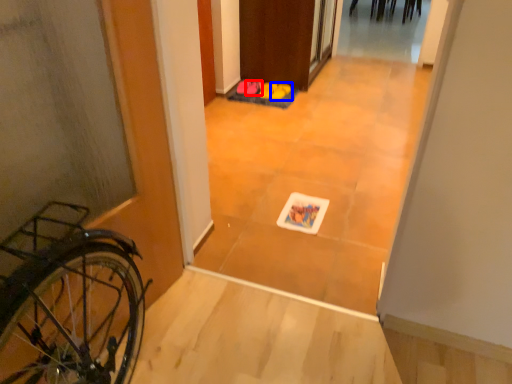
Question: Among these objects, which one is nearest to the camera, footwear (highlighted by a red box) or footwear (highlighted by a blue box)?

Choices:
 (A) footwear
 (B) footwear

Answer: (B)